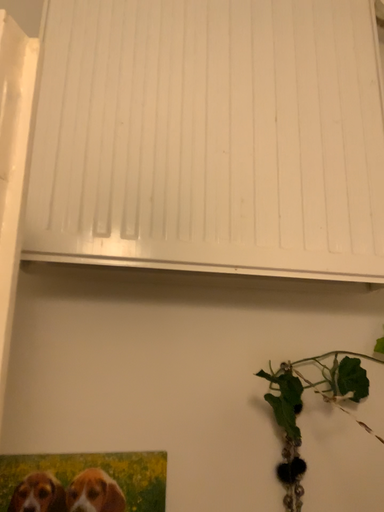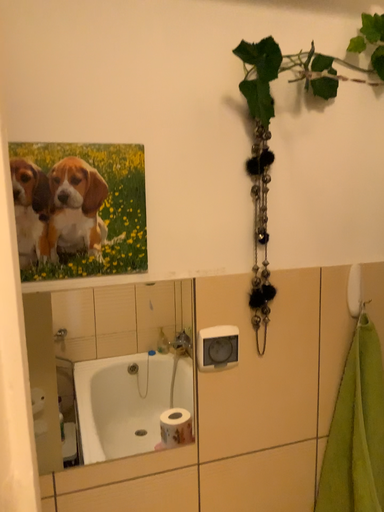
Question: How did the camera likely rotate when shooting the video?

Choices:
 (A) rotated right
 (B) rotated left

Answer: (A)